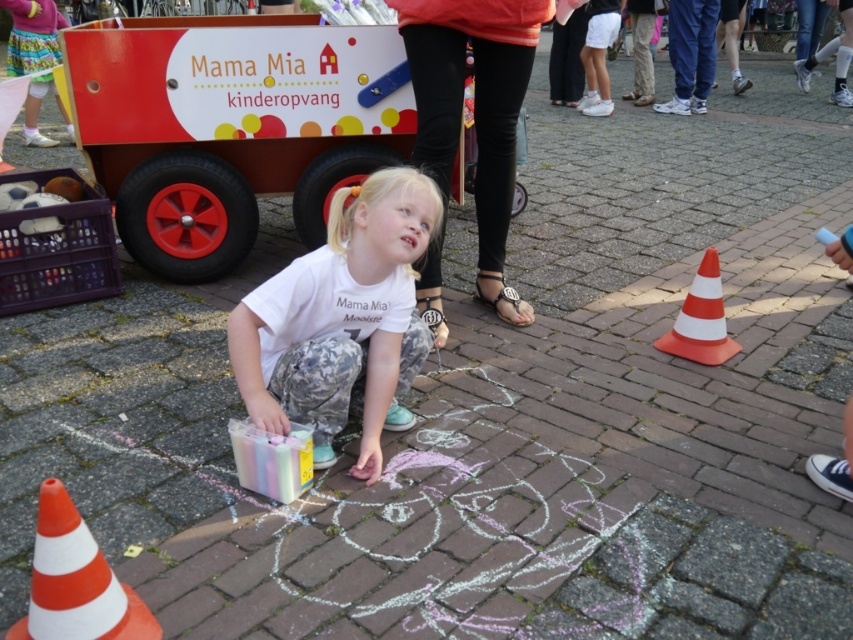
You are a photographer trying to capture a candid shot of the child drawing with chalk. You notice the pastel cotton skirt at upper left in the background. To avoid the skirt from blocking the child, where should you position yourself relative to the skirt?

To avoid the pastel cotton skirt at upper left from blocking the child, position yourself to the right side of the skirt since it is located at the upper left corner of the scene.